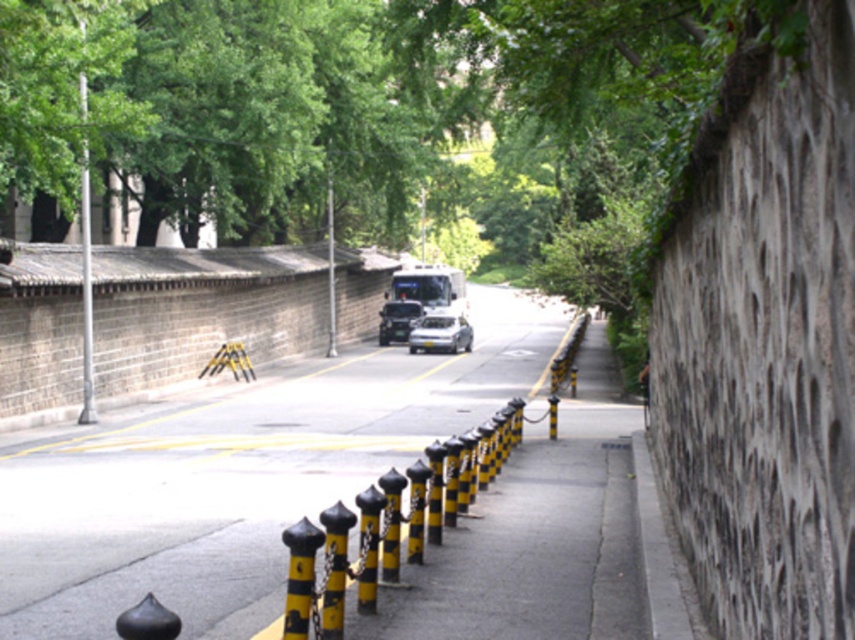
Between yellow/black striped barrier at center and glossy white van at center, which one is positioned higher?

Positioned higher is yellow/black striped barrier at center.

The height and width of the screenshot is (640, 855). What do you see at coordinates (199, 308) in the screenshot?
I see `yellow/black striped barrier at center` at bounding box center [199, 308].

Is point (32, 321) behind point (391, 304)?

No, (32, 321) is in front of (391, 304).

Locate an element on the screen. The image size is (855, 640). yellow/black striped barrier at center is located at coordinates (199, 308).

Between yellow/black striped bollards at center and yellow/black striped barrier at center, which one is positioned higher?

Positioned higher is yellow/black striped barrier at center.

Which is in front, point (57, 445) or point (50, 346)?

Positioned in front is point (57, 445).

Image resolution: width=855 pixels, height=640 pixels. Find the location of `yellow/black striped bollards at center`. yellow/black striped bollards at center is located at coordinates (234, 477).

How far apart are yellow/black striped bollards at center and glossy white van at center?

yellow/black striped bollards at center and glossy white van at center are 7.72 meters apart.

Consider the image. Is yellow/black striped bollards at center thinner than glossy white van at center?

No, yellow/black striped bollards at center is not thinner than glossy white van at center.

Where is `yellow/black striped bollards at center`? yellow/black striped bollards at center is located at coordinates tap(234, 477).